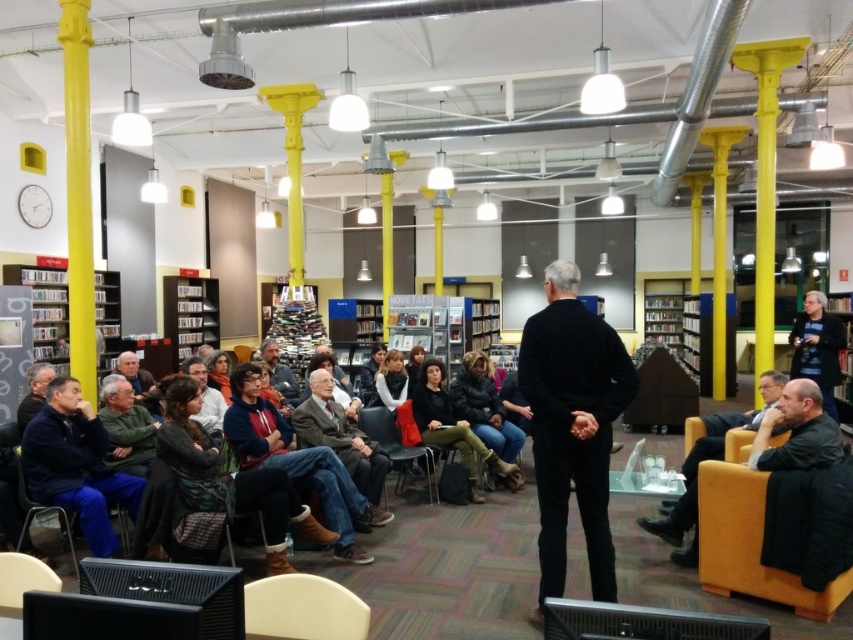
Consider the image. You are standing in the library and see two points marked in the image. The first point is at coordinates point (181,349) and the second is at point (367,435). Which point is closer to you?

Point (181,349) is further to the camera than point (367,435), so the second point is closer to you.

Consider the image. You are an event organizer who needs to determine the seating arrangement based on the speaker and attendees. Considering the dark gray fabric jacket at center and the matte gray sweater at lower left, which clothing item is taller?

The dark gray fabric jacket at center is taller than the matte gray sweater at lower left.

Looking at this image, you are standing in the library and want to place a tall potted plant on the wooden bookshelf at center. The potted plant is as tall as the matte black jacket at lower center. Will the plant fit vertically on the bookshelf?

The wooden bookshelf at center has a greater height compared to the matte black jacket at lower center. Since the potted plant is as tall as the matte black jacket at lower center, it will fit vertically on the bookshelf because the bookshelf is taller than the jacket.